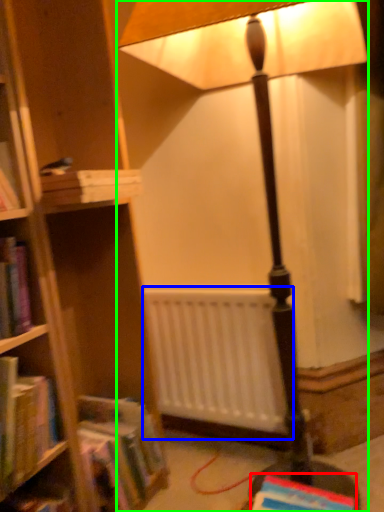
Question: Which object is positioned farthest from book (highlighted by a red box)? Select from radiator (highlighted by a blue box) and lamp (highlighted by a green box).

Choices:
 (A) radiator
 (B) lamp

Answer: (B)